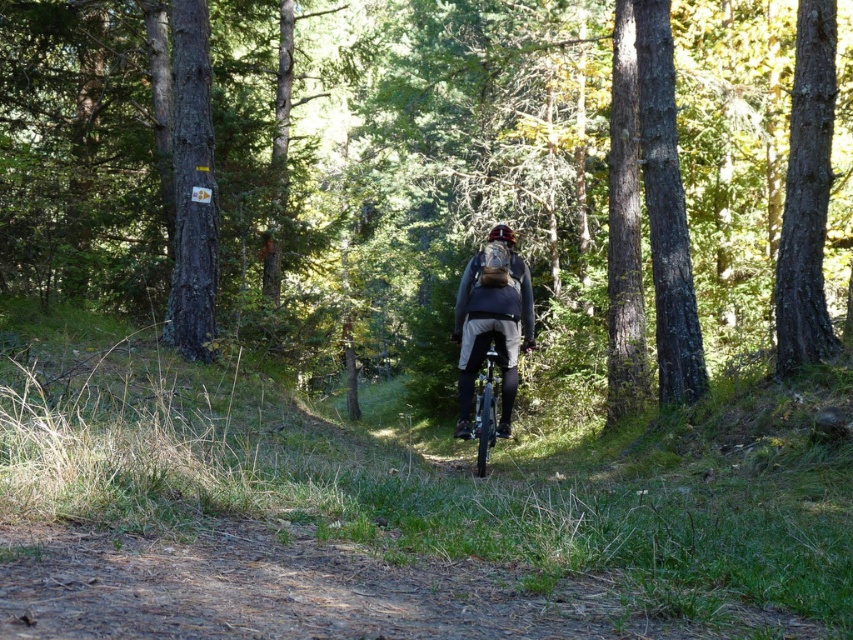
Question: Which object appears farthest from the camera in this image?

Choices:
 (A) green matte forest at center
 (B) shiny silver bicycle at center

Answer: (A)

Question: Can you confirm if shiny silver bicycle at center is positioned to the right of matte black helmet at center?

Choices:
 (A) yes
 (B) no

Answer: (B)

Question: Does green matte forest at center lie behind matte gray jacket at center?

Choices:
 (A) yes
 (B) no

Answer: (A)

Question: Which object appears closest to the camera in this image?

Choices:
 (A) matte black helmet at center
 (B) brown rough bark tree at right
 (C) matte gray jacket at center
 (D) green matte forest at center

Answer: (C)

Question: Which point is closer to the camera taking this photo?

Choices:
 (A) (796, 362)
 (B) (515, 314)
 (C) (490, 376)

Answer: (B)

Question: Can you confirm if brown rough bark tree at right is positioned above matte gray jacket at center?

Choices:
 (A) yes
 (B) no

Answer: (A)